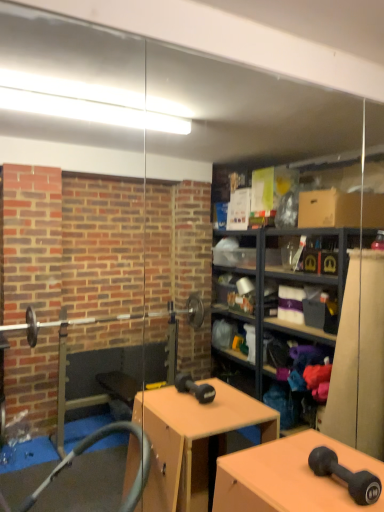
Measure the distance between matte black dumbbell at center and camera.

The depth of matte black dumbbell at center is 3.87 feet.

Where is `matte black dumbbell at center`? This screenshot has height=512, width=384. matte black dumbbell at center is located at coordinates (289, 477).

The height and width of the screenshot is (512, 384). What do you see at coordinates (289, 477) in the screenshot? I see `matte black dumbbell at center` at bounding box center [289, 477].

Where is `matte black dumbbell at lower right`? matte black dumbbell at lower right is located at coordinates (346, 476).

This screenshot has height=512, width=384. Describe the element at coordinates (346, 476) in the screenshot. I see `matte black dumbbell at lower right` at that location.

You are a GUI agent. You are given a task and a screenshot of the screen. Output one action in this format:
    pyautogui.click(x=<x>, y=<y>)
    Task: Click on the matte black dumbbell at center
    
    Given the screenshot: What is the action you would take?
    pyautogui.click(x=289, y=477)

In the image, is matte black dumbbell at center on the left side or the right side of matte black dumbbell at lower right?

Based on their positions, matte black dumbbell at center is located to the left of matte black dumbbell at lower right.

Which object is further away from the camera taking this photo, matte black dumbbell at center or matte black dumbbell at lower right?

matte black dumbbell at lower right is more distant.

Which is nearer, [352,469] or [317,474]?

Point [352,469]

From the image's perspective, is matte black dumbbell at center beneath matte black dumbbell at lower right?

Yes, from the image's perspective, matte black dumbbell at center is below matte black dumbbell at lower right.

From a real-world perspective, is matte black dumbbell at center on top of matte black dumbbell at lower right?

No, from a real-world perspective, matte black dumbbell at center is not over matte black dumbbell at lower right

Can you confirm if matte black dumbbell at center is wider than matte black dumbbell at lower right?

Yes.

Is matte black dumbbell at center taller than matte black dumbbell at lower right?

Correct, matte black dumbbell at center is much taller as matte black dumbbell at lower right.

Is matte black dumbbell at center bigger than matte black dumbbell at lower right?

Correct, matte black dumbbell at center is larger in size than matte black dumbbell at lower right.

Is matte black dumbbell at center outside of matte black dumbbell at lower right?

Yes, matte black dumbbell at center is not within matte black dumbbell at lower right.

Is matte black dumbbell at center with matte black dumbbell at lower right?

No, matte black dumbbell at center is not in contact with matte black dumbbell at lower right.

Does matte black dumbbell at center turn towards matte black dumbbell at lower right?

No, matte black dumbbell at center is not aimed at matte black dumbbell at lower right.

From the picture: Can you tell me how much matte black dumbbell at center and matte black dumbbell at lower right differ in facing direction?

1.64 degrees.

Measure the distance between matte black dumbbell at center and matte black dumbbell at lower right.

matte black dumbbell at center and matte black dumbbell at lower right are 5.15 inches apart from each other.

In the image, there is a matte black dumbbell at lower right. Identify the location of table below it (from the image's perspective). (289, 477).

Can you confirm if matte black dumbbell at lower right is positioned to the left of matte black dumbbell at center?

In fact, matte black dumbbell at lower right is to the right of matte black dumbbell at center.

Considering the positions of objects matte black dumbbell at lower right and matte black dumbbell at center in the image provided, who is behind, matte black dumbbell at lower right or matte black dumbbell at center?

matte black dumbbell at lower right is further away from the camera.

Considering the positions of point (370, 477) and point (278, 492), is point (370, 477) closer or farther from the camera than point (278, 492)?

Clearly, point (370, 477) is closer to the camera than point (278, 492).

From the image's perspective, which is below, matte black dumbbell at lower right or matte black dumbbell at center?

matte black dumbbell at center is shown below in the image.

From a real-world perspective, which is physically below, matte black dumbbell at lower right or matte black dumbbell at center?

matte black dumbbell at center.

In the scene shown: Looking at their sizes, would you say matte black dumbbell at lower right is wider or thinner than matte black dumbbell at center?

Clearly, matte black dumbbell at lower right has less width compared to matte black dumbbell at center.

Which of these two, matte black dumbbell at lower right or matte black dumbbell at center, stands shorter?

matte black dumbbell at lower right.

Who is smaller, matte black dumbbell at lower right or matte black dumbbell at center?

matte black dumbbell at lower right is smaller.

Would you say matte black dumbbell at lower right contains matte black dumbbell at center?

Definitely not — matte black dumbbell at center is not inside matte black dumbbell at lower right.

Is the surface of matte black dumbbell at lower right in direct contact with matte black dumbbell at center?

There is a gap between matte black dumbbell at lower right and matte black dumbbell at center.

Is matte black dumbbell at center at the back of matte black dumbbell at lower right?

No, matte black dumbbell at lower right is not facing the opposite direction of matte black dumbbell at center.

How different are the orientations of matte black dumbbell at lower right and matte black dumbbell at center in degrees?

The angular difference between matte black dumbbell at lower right and matte black dumbbell at center is 1.64 degrees.

How distant is matte black dumbbell at lower right from matte black dumbbell at center?

A distance of 5.15 inches exists between matte black dumbbell at lower right and matte black dumbbell at center.

You are a GUI agent. You are given a task and a screenshot of the screen. Output one action in this format:
    pyautogui.click(x=<x>, y=<y>)
    Task: Click on the dumbbell positioned vertically above the matte black dumbbell at center (from a real-world perspective)
    The width and height of the screenshot is (384, 512).
    Given the screenshot: What is the action you would take?
    click(346, 476)

At what (x,y) coordinates should I click in order to perform the action: click on table that is below the matte black dumbbell at lower right (from the image's perspective). Please return your answer as a coordinate pair (x, y). This screenshot has width=384, height=512. Looking at the image, I should click on (289, 477).

At what (x,y) coordinates should I click in order to perform the action: click on dumbbell above the matte black dumbbell at center (from the image's perspective). Please return your answer as a coordinate pair (x, y). Image resolution: width=384 pixels, height=512 pixels. Looking at the image, I should click on tap(346, 476).